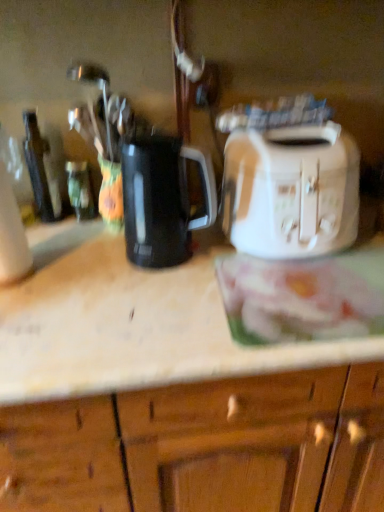
Where is `vacant space underneath white glossy bread at center (from a real-world perspective)`? vacant space underneath white glossy bread at center (from a real-world perspective) is located at coordinates (317, 291).